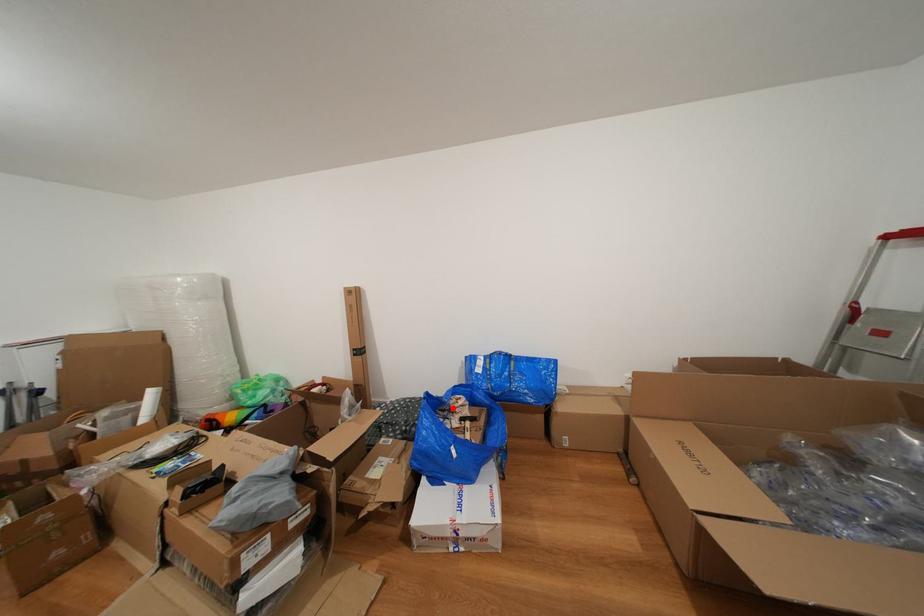
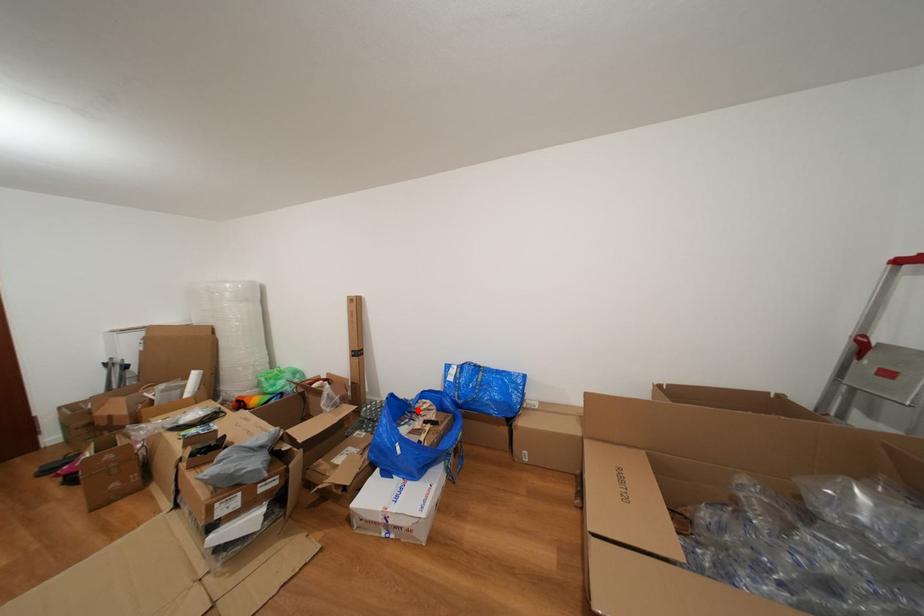
I am providing you with two images of the same scene from different viewpoints. A red point is marked on the first image and another point is marked on the second image. Do the highlighted points in image1 and image2 indicate the same real-world spot?

Yes